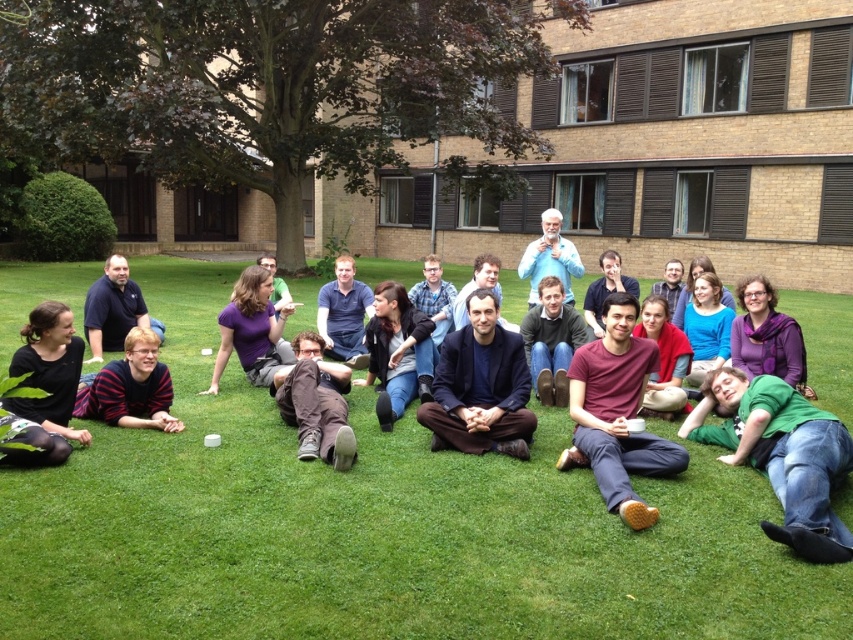
You are standing in the middle of the group and notice the green grass at center and the blue cotton shirt at center. From your current position, which object is located to the right?

The green grass at center is located to the right of the blue cotton shirt at center.